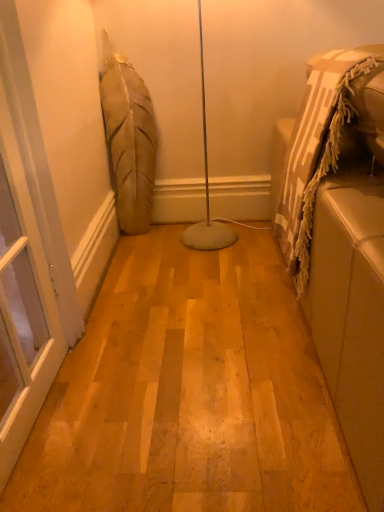
Question: Is beige fabric couch at right touching transparent glass screen door at left?

Choices:
 (A) no
 (B) yes

Answer: (A)

Question: Considering the relative sizes of beige fabric couch at right and transparent glass screen door at left in the image provided, is beige fabric couch at right wider than transparent glass screen door at left?

Choices:
 (A) no
 (B) yes

Answer: (B)

Question: Is beige fabric couch at right turned away from transparent glass screen door at left?

Choices:
 (A) yes
 (B) no

Answer: (A)

Question: Could transparent glass screen door at left be considered to be inside beige fabric couch at right?

Choices:
 (A) no
 (B) yes

Answer: (A)

Question: From the image's perspective, is beige fabric couch at right over transparent glass screen door at left?

Choices:
 (A) yes
 (B) no

Answer: (A)

Question: Are beige fabric couch at right and transparent glass screen door at left far apart?

Choices:
 (A) no
 (B) yes

Answer: (A)

Question: Would you say transparent glass screen door at left is a long distance from beige fabric couch at right?

Choices:
 (A) no
 (B) yes

Answer: (A)

Question: Can we say transparent glass screen door at left lies outside beige fabric couch at right?

Choices:
 (A) no
 (B) yes

Answer: (B)

Question: From a real-world perspective, is transparent glass screen door at left located higher than beige fabric couch at right?

Choices:
 (A) yes
 (B) no

Answer: (A)

Question: Considering the relative positions of transparent glass screen door at left and beige fabric couch at right in the image provided, is transparent glass screen door at left to the right of beige fabric couch at right from the viewer's perspective?

Choices:
 (A) yes
 (B) no

Answer: (B)

Question: Is transparent glass screen door at left to the left of beige fabric couch at right from the viewer's perspective?

Choices:
 (A) yes
 (B) no

Answer: (A)

Question: Considering the relative sizes of transparent glass screen door at left and beige fabric couch at right in the image provided, is transparent glass screen door at left taller than beige fabric couch at right?

Choices:
 (A) yes
 (B) no

Answer: (A)

Question: In the image, is transparent glass screen door at left on the left side or the right side of beige fabric couch at right?

Choices:
 (A) right
 (B) left

Answer: (B)